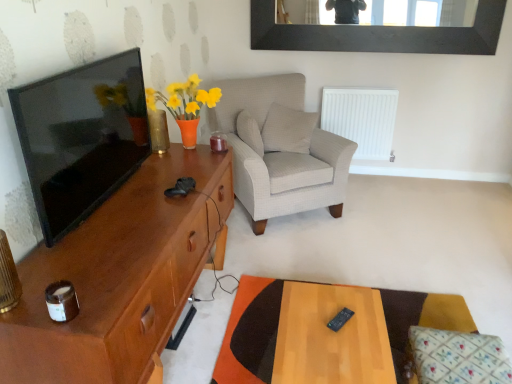
Identify the location of matte black tv at left. This screenshot has width=512, height=384. (79, 139).

Find the location of a particular element. white textured pillow at center, which is counted as the 2th pillow, starting from the bottom is located at coordinates (249, 132).

The height and width of the screenshot is (384, 512). I want to click on floral fabric cushion at lower right, placed as the 3th pillow when sorted from back to front, so click(x=458, y=357).

This screenshot has height=384, width=512. I want to click on wooden table at lower right, so click(250, 333).

I want to click on black plastic remote at center, so click(x=340, y=319).

The width and height of the screenshot is (512, 384). In order to click on translucent glass vase at left in this screenshot , I will do tap(158, 131).

Where is `matte black tv at left`? This screenshot has height=384, width=512. matte black tv at left is located at coordinates (79, 139).

Is light gray fabric armchair at center with white textured pillow at center, positioned as the 1th pillow in left-to-right order?

No, light gray fabric armchair at center is not in contact with white textured pillow at center, positioned as the 1th pillow in left-to-right order.

Where is `pillow to the left of light gray fabric armchair at center`? pillow to the left of light gray fabric armchair at center is located at coordinates (249, 132).

Can you confirm if light gray fabric armchair at center is positioned to the left of white textured pillow at center, acting as the second pillow starting from the back?

No, light gray fabric armchair at center is not to the left of white textured pillow at center, acting as the second pillow starting from the back.

Between light gray fabric armchair at center and white textured pillow at center, positioned as the 1th pillow in left-to-right order, which one has larger width?

light gray fabric armchair at center is wider.

Is matte black tv at left completely or partially outside of translucent glass vase at left?

Absolutely, matte black tv at left is external to translucent glass vase at left.

Does matte black tv at left have a lesser height compared to translucent glass vase at left?

No, matte black tv at left is not shorter than translucent glass vase at left.

Consider the image. Which is further, (83, 133) or (167, 131)?

Point (167, 131)

Considering the positions of objects matte black tv at left and translucent glass vase at left in the image provided, who is behind, matte black tv at left or translucent glass vase at left?

translucent glass vase at left is further away from the camera.

From the image's perspective, is white textured pillow at center, arranged as the 2th pillow when viewed from the front, over white textured pillow at center, marked as the 1th pillow in a top-to-bottom arrangement?

No, from the image's perspective, white textured pillow at center, arranged as the 2th pillow when viewed from the front, is not on top of white textured pillow at center, marked as the 1th pillow in a top-to-bottom arrangement.

Is white textured pillow at center, the second pillow when ordered from left to right, at the back of white textured pillow at center, which ranks as the third pillow in right-to-left order?

No, white textured pillow at center, the second pillow when ordered from left to right, is not at the back of white textured pillow at center, which ranks as the third pillow in right-to-left order.

From the picture: Considering the relative sizes of white textured pillow at center, positioned as the 1th pillow in left-to-right order, and white textured pillow at center, which is counted as the 1th pillow, starting from the back, in the image provided, is white textured pillow at center, positioned as the 1th pillow in left-to-right order, taller than white textured pillow at center, which is counted as the 1th pillow, starting from the back,?

Yes, white textured pillow at center, positioned as the 1th pillow in left-to-right order, is taller than white textured pillow at center, which is counted as the 1th pillow, starting from the back.

Between matte black tv at left and brown wood cabinet at left, which one has larger width?

brown wood cabinet at left is wider.

Is matte black tv at left located outside brown wood cabinet at left?

Absolutely, matte black tv at left is external to brown wood cabinet at left.

Who is smaller, matte black tv at left or brown wood cabinet at left?

Smaller between the two is matte black tv at left.

Does matte black tv at left touch brown wood cabinet at left?

No.

Is brown wood cabinet at left completely or partially inside light gray fabric armchair at center?

That's incorrect, brown wood cabinet at left is not inside light gray fabric armchair at center.

How different are the orientations of light gray fabric armchair at center and brown wood cabinet at left in degrees?

light gray fabric armchair at center and brown wood cabinet at left are facing 58.8 degrees away from each other.

Can you confirm if light gray fabric armchair at center is positioned to the right of brown wood cabinet at left?

Yes.

Is light gray fabric armchair at center looking in the opposite direction of brown wood cabinet at left?

light gray fabric armchair at center does not have its back to brown wood cabinet at left.

Does white plastic radiator at center right appear on the right side of black plastic remote at center?

Yes.

Does point (328, 87) appear closer or farther from the camera than point (341, 313)?

Point (328, 87) is positioned farther from the camera compared to point (341, 313).

Is white plastic radiator at center right wider or thinner than black plastic remote at center?

Clearly, white plastic radiator at center right has less width compared to black plastic remote at center.

How far apart are white plastic radiator at center right and black plastic remote at center?

A distance of 6.97 feet exists between white plastic radiator at center right and black plastic remote at center.

At what (x,y) coordinates should I click in order to perform the action: click on the 2nd pillow counting from the left of the wooden table at lower right. Please return your answer as a coordinate pair (x, y). The height and width of the screenshot is (384, 512). Looking at the image, I should click on (249, 132).

From the picture: Can you tell me how much white textured pillow at center, arranged as the 2th pillow when viewed from the front, and wooden table at lower right differ in facing direction?

The facing directions of white textured pillow at center, arranged as the 2th pillow when viewed from the front, and wooden table at lower right are 13.9 degrees apart.

Can wooden table at lower right be found inside white textured pillow at center, which ranks as the third pillow in right-to-left order?

No, wooden table at lower right is not surrounded by white textured pillow at center, which ranks as the third pillow in right-to-left order.

The width and height of the screenshot is (512, 384). Find the location of `pillow lying on the left of light gray fabric armchair at center`. pillow lying on the left of light gray fabric armchair at center is located at coordinates (249, 132).

At what (x,y) coordinates should I click in order to perform the action: click on glass vase behind the matte black tv at left. Please return your answer as a coordinate pair (x, y). Looking at the image, I should click on pos(158,131).

Considering their positions, is black matte picture frame at upper center positioned further to white plastic radiator at center right than matte black tv at left?

matte black tv at left.

From the image, which object appears to be farther from wooden rectangular table at center, white plastic radiator at center right or white textured pillow at center, arranged as the 2th pillow when viewed from the front?

white plastic radiator at center right is further to wooden rectangular table at center.

Which object lies nearer to the anchor point translucent glass vase at left, wooden table at lower right or white textured pillow at center, positioned as the 1th pillow in left-to-right order?

Based on the image, white textured pillow at center, positioned as the 1th pillow in left-to-right order, appears to be nearer to translucent glass vase at left.

From the image, which object appears to be nearer to white plastic radiator at center right, floral fabric cushion at lower right, the 1th pillow in the right-to-left sequence, or white textured pillow at center, the second pillow when ordered from left to right?

Among the two, white textured pillow at center, the second pillow when ordered from left to right, is located nearer to white plastic radiator at center right.

Considering their positions, is black matte picture frame at upper center positioned further to wooden rectangular table at center than white textured pillow at center, which is counted as the 1th pillow, starting from the back?

black matte picture frame at upper center.

Estimate the real-world distances between objects in this image. Which object is closer to wooden rectangular table at center, translucent glass vase at left or matte black tv at left?

Among the two, matte black tv at left is located nearer to wooden rectangular table at center.

Considering their positions, is white plastic radiator at center right positioned closer to black matte picture frame at upper center than floral fabric cushion at lower right, the 1th pillow in the right-to-left sequence?

white plastic radiator at center right.

Estimate the real-world distances between objects in this image. Which object is further from black plastic remote at center, floral fabric cushion at lower right, the 1th pillow in the right-to-left sequence, or white textured pillow at center, marked as the 1th pillow in a top-to-bottom arrangement?

white textured pillow at center, marked as the 1th pillow in a top-to-bottom arrangement, is positioned further to the anchor black plastic remote at center.

The height and width of the screenshot is (384, 512). Find the location of `chair between black matte picture frame at upper center and black plastic remote at center in the up-down direction`. chair between black matte picture frame at upper center and black plastic remote at center in the up-down direction is located at coordinates pos(280,149).

Image resolution: width=512 pixels, height=384 pixels. I want to click on table located between brown wood cabinet at left and floral fabric cushion at lower right, the 1th pillow when ordered from bottom to top, in the left-right direction, so click(331, 337).

Find the location of `picture frame positioned between brown wood cabinet at left and white plastic radiator at center right from near to far`. picture frame positioned between brown wood cabinet at left and white plastic radiator at center right from near to far is located at coordinates (379, 34).

What are the coordinates of `pillow situated between translucent glass vase at left and white textured pillow at center, the second pillow when ordered from left to right, from left to right` in the screenshot? It's located at (249, 132).